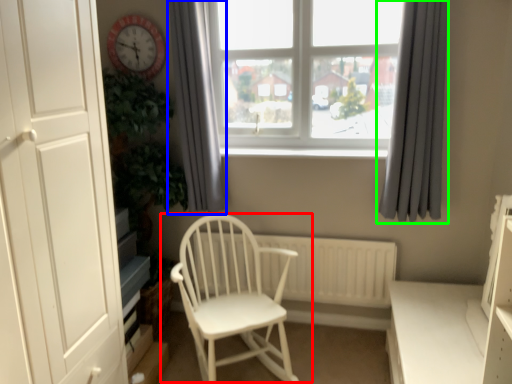
Question: Which object is positioned closest to chair (highlighted by a red box)? Select from curtain (highlighted by a blue box) and curtain (highlighted by a green box).

Choices:
 (A) curtain
 (B) curtain

Answer: (A)